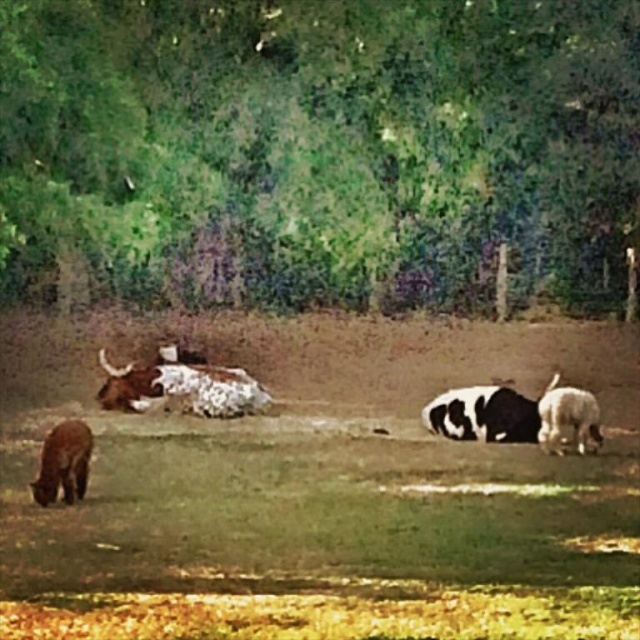
Can you confirm if black and white fur at center is shorter than white woolly sheep at lower right?

Indeed, black and white fur at center has a lesser height compared to white woolly sheep at lower right.

Can you confirm if black and white fur at center is bigger than white woolly sheep at lower right?

Correct, black and white fur at center is larger in size than white woolly sheep at lower right.

Is point (500, 422) positioned behind point (554, 388)?

Yes, point (500, 422) is behind point (554, 388).

Locate an element on the screen. black and white fur at center is located at coordinates (483, 413).

Does green leafy tree at upper center appear over brown furry dog at lower left?

Indeed, green leafy tree at upper center is positioned over brown furry dog at lower left.

Who is taller, green leafy tree at upper center or brown furry dog at lower left?

green leafy tree at upper center

Identify the location of green leafy tree at upper center. (320, 152).

Is the position of brown furry dog at lower left less distant than that of white woolly sheep at lower right?

Yes, brown furry dog at lower left is closer to the viewer.

Who is shorter, brown furry dog at lower left or white woolly sheep at lower right?

brown furry dog at lower left

Is point (58, 440) closer to viewer compared to point (586, 406)?

Yes.

In order to click on brown furry dog at lower left in this screenshot , I will do `click(64, 461)`.